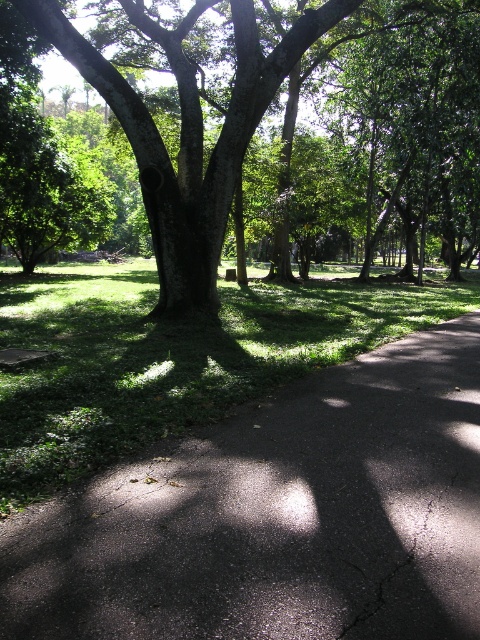
Who is more distant from viewer, (393, 353) or (96, 80)?

The point (96, 80) is behind.

From the picture: Who is more forward, (109, 636) or (239, 128)?

Positioned in front is point (109, 636).

This screenshot has width=480, height=640. Identify the location of black asphalt pavement at center. (277, 516).